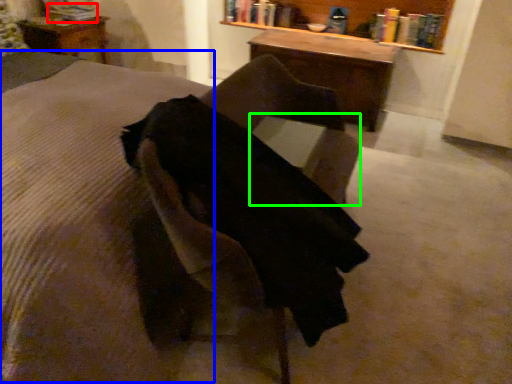
Question: Which is farther away from book (highlighted by a red box)? mattress (highlighted by a blue box) or table (highlighted by a green box)?

Choices:
 (A) mattress
 (B) table

Answer: (B)